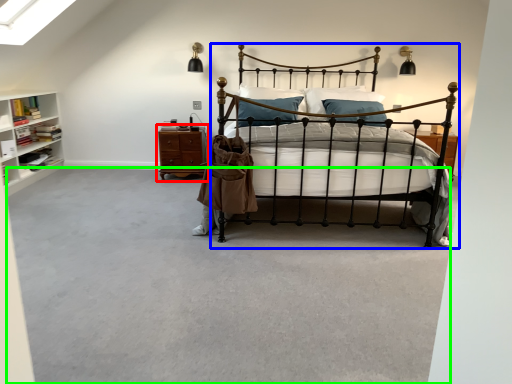
Question: Based on their relative distances, which object is farther from nightstand (highlighted by a red box)? Choose from bed (highlighted by a blue box) and concrete (highlighted by a green box).

Choices:
 (A) bed
 (B) concrete

Answer: (A)